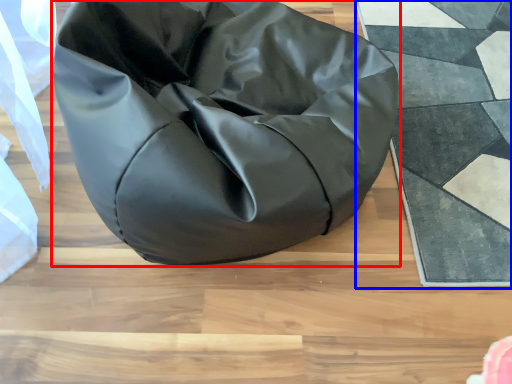
Question: Which point is further to the camera, furniture (highlighted by a red box) or mat (highlighted by a blue box)?

Choices:
 (A) furniture
 (B) mat

Answer: (B)